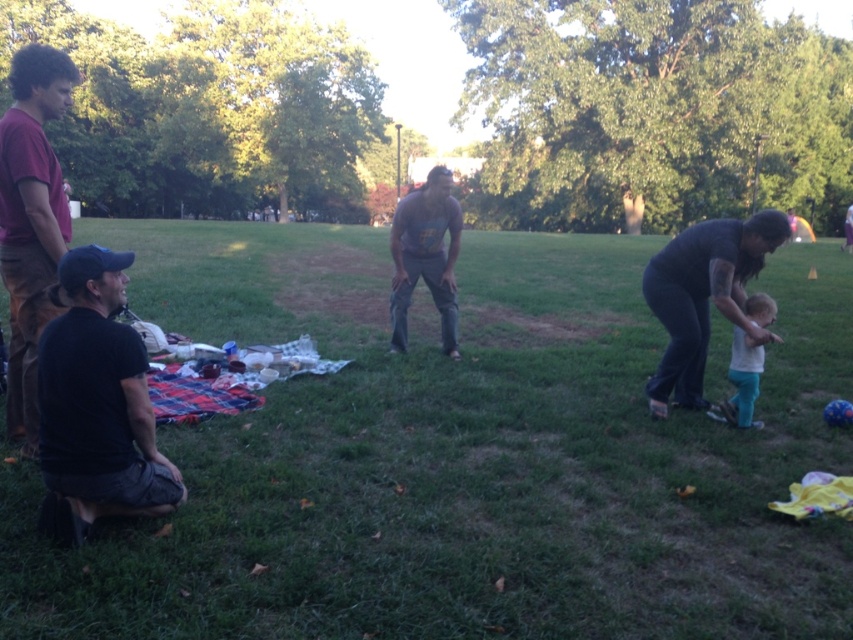
Does maroon cotton shirt at left have a lesser width compared to white cotton shirt at right?

In fact, maroon cotton shirt at left might be wider than white cotton shirt at right.

Who is more distant from viewer, (x=67, y=99) or (x=727, y=417)?

The point (x=727, y=417) is behind.

Locate an element on the screen. The height and width of the screenshot is (640, 853). maroon cotton shirt at left is located at coordinates (32, 220).

Based on the photo, is black cotton shirt at lower left to the left of maroon cotton shirt at left from the viewer's perspective?

Incorrect, black cotton shirt at lower left is not on the left side of maroon cotton shirt at left.

Is point (103, 444) positioned before point (33, 339)?

Yes, it is in front of point (33, 339).

Where is `black cotton shirt at lower left`? Image resolution: width=853 pixels, height=640 pixels. black cotton shirt at lower left is located at coordinates (97, 404).

Based on the photo, who is more forward, (36, 269) or (451, 312)?

Positioned in front is point (36, 269).

Can you confirm if maroon cotton shirt at left is positioned below dark gray t-shirt at center?

Indeed, maroon cotton shirt at left is positioned under dark gray t-shirt at center.

Identify the location of maroon cotton shirt at left. This screenshot has width=853, height=640. (32, 220).

Identify the location of maroon cotton shirt at left. (32, 220).